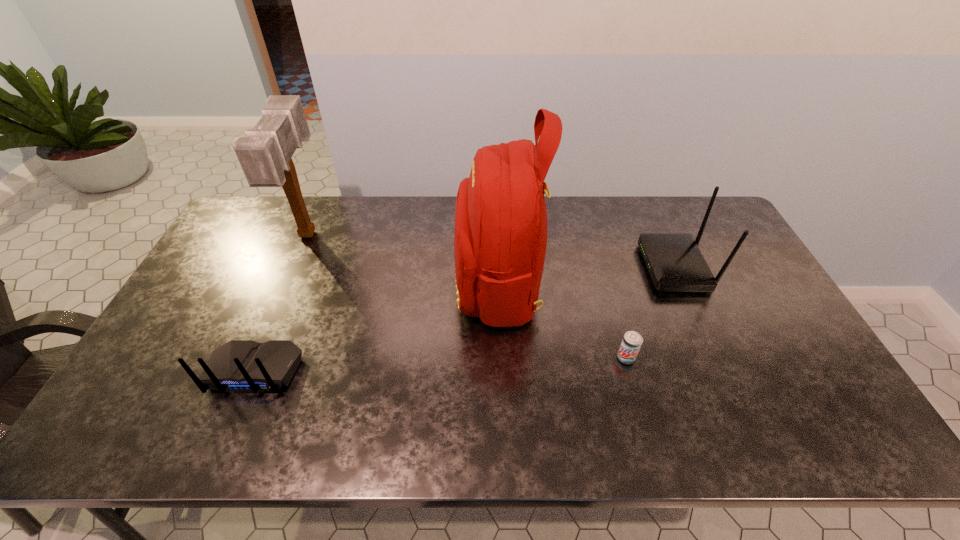
This screenshot has height=540, width=960. In order to click on backpack in this screenshot , I will do `click(500, 238)`.

At what (x,y) coordinates should I click in order to perform the action: click on the tallest object. Please return your answer as a coordinate pair (x, y). The image size is (960, 540). Looking at the image, I should click on (500, 238).

You are a GUI agent. You are given a task and a screenshot of the screen. Output one action in this format:
    pyautogui.click(x=<x>, y=<y>)
    Task: Click on the second tallest object
    The height and width of the screenshot is (540, 960).
    Given the screenshot: What is the action you would take?
    pyautogui.click(x=265, y=153)

The image size is (960, 540). In order to click on the third shortest object in this screenshot , I will do `click(675, 263)`.

Where is `the farther router`? the farther router is located at coordinates (675, 263).

Where is `the fourth tallest object`? This screenshot has width=960, height=540. the fourth tallest object is located at coordinates (239, 366).

Locate an element on the screen. the nearer router is located at coordinates (239, 366).

Where is `the fourth object from left to right`? the fourth object from left to right is located at coordinates (632, 341).

This screenshot has height=540, width=960. I want to click on beer can, so click(632, 341).

Find the location of a particular element. Image resolution: width=960 pixels, height=540 pixels. vacant region located on the front-facing side of the backpack is located at coordinates (381, 282).